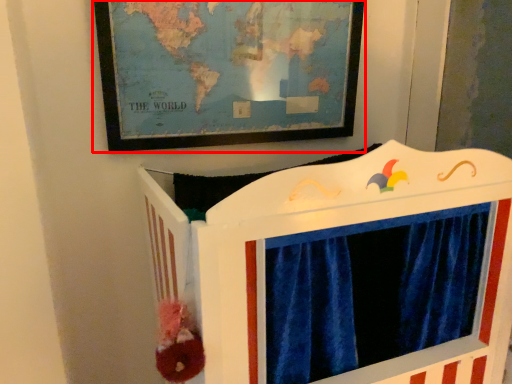
Question: Observing the image, what is the correct spatial positioning of picture frame (annotated by the red box) in reference to furniture?

Choices:
 (A) left
 (B) right

Answer: (A)